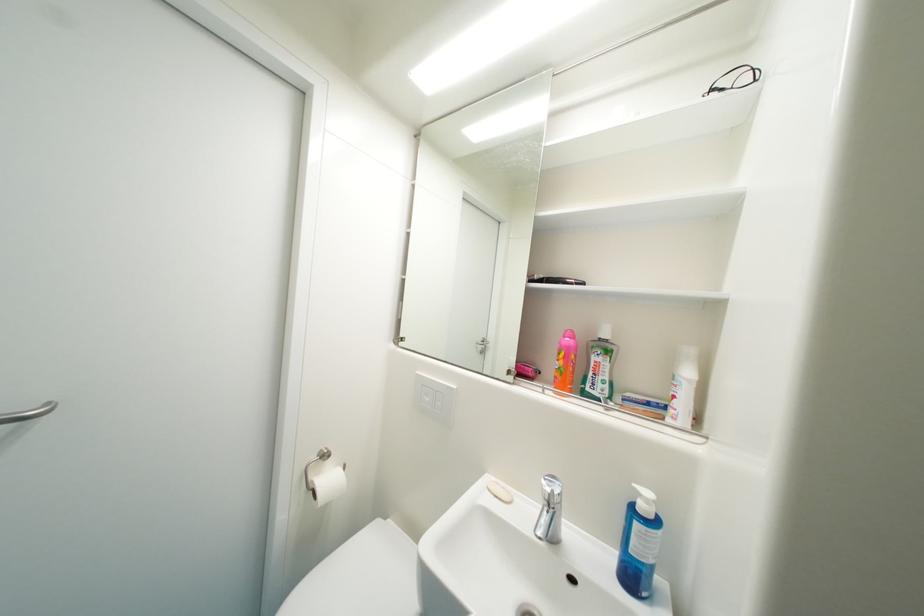
Where is `pink bottle cap`? This screenshot has height=616, width=924. pink bottle cap is located at coordinates (565, 362).